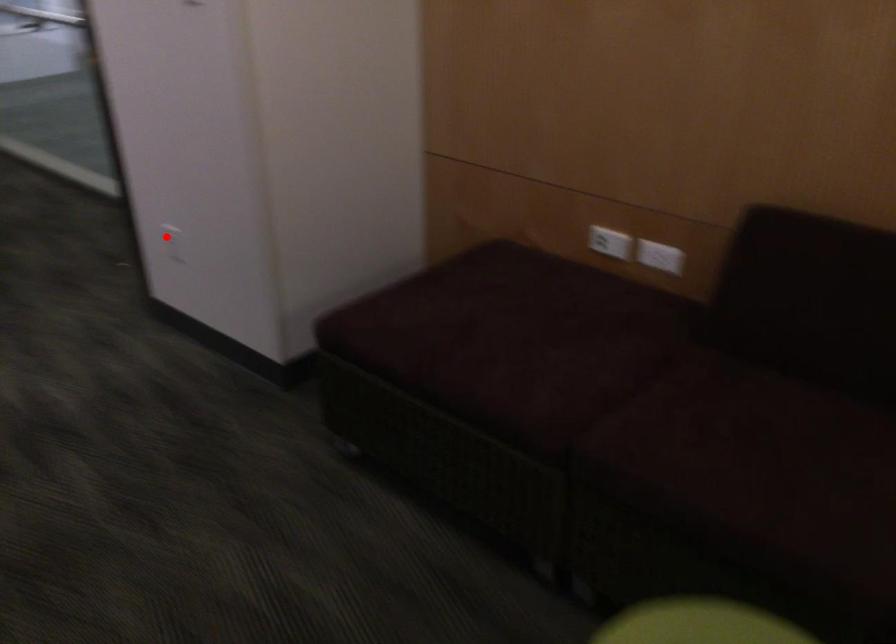
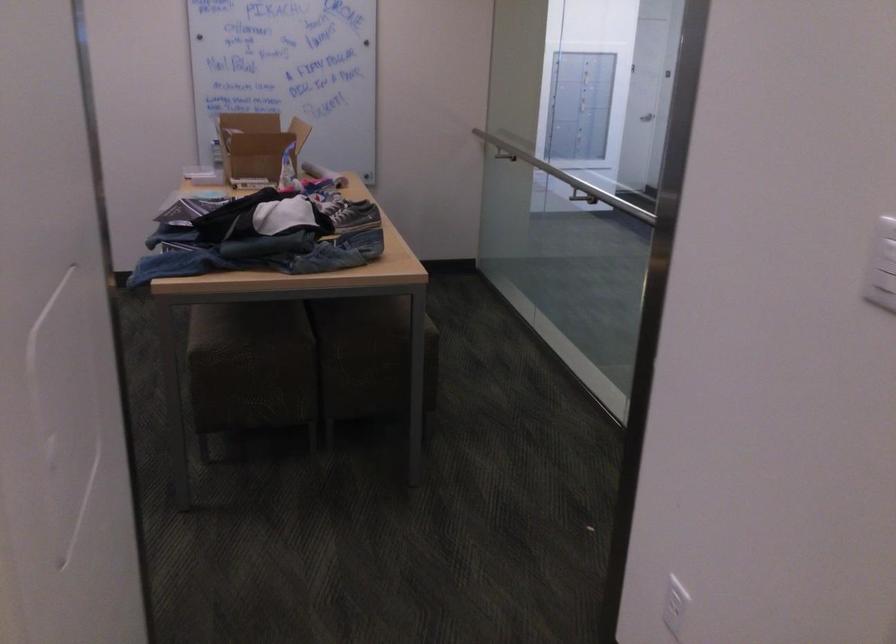
Where in the second image is the point corresponding to the highlighted location from the first image?

(675, 605)